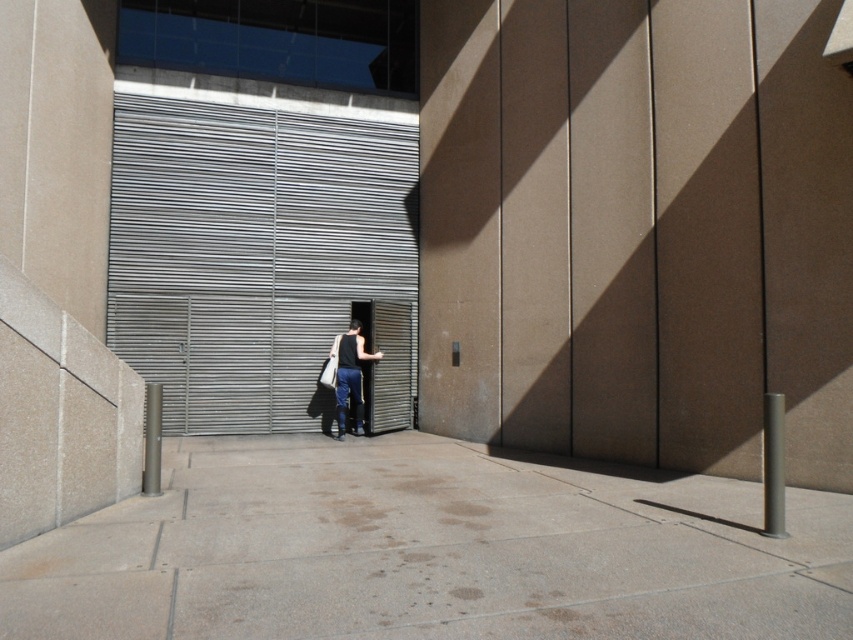
You are a delivery person who needs to place a small package between the dark gray jeans at center and the white fabric shopping bag at center. Can you fit it there?

The dark gray jeans at center and white fabric shopping bag at center are 10.31 inches apart, so yes, you can fit a small package between them as the space is sufficient.

You are a delivery person standing at the entrance of the building. You need to deliver a package to the office located at point [250,252]. Where should you go to find the office?

The office is located at the metallic gray garage door at center, which is at point [250,252].